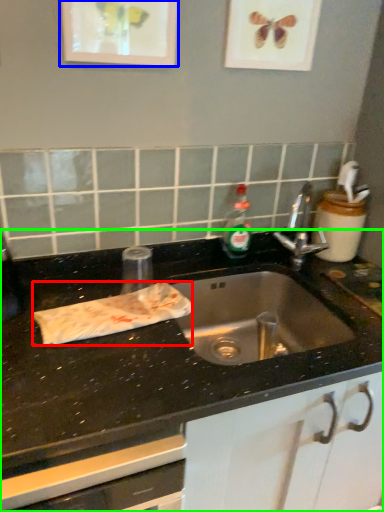
Question: Which object is the farthest from material (highlighted by a red box)? Choose among these: picture frame (highlighted by a blue box) or countertop (highlighted by a green box).

Choices:
 (A) picture frame
 (B) countertop

Answer: (A)